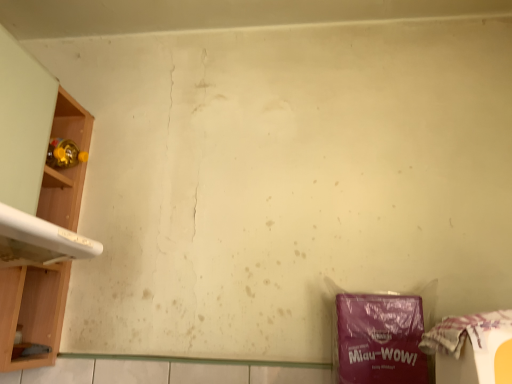
Question: In terms of size, does wooden shelf at left appear bigger or smaller than plastic bag at lower right?

Choices:
 (A) small
 (B) big

Answer: (B)

Question: Would you say wooden shelf at left is to the left or to the right of plastic bag at lower right in the picture?

Choices:
 (A) left
 (B) right

Answer: (A)

Question: Based on their relative distances, which object is farther from the plastic bag at lower right?

Choices:
 (A) wooden shelf at left
 (B) purple matte plastic bag at lower right
 (C) white glossy washing machine at left

Answer: (A)

Question: Which of these objects is positioned farthest from the wooden shelf at left?

Choices:
 (A) white glossy washing machine at left
 (B) plastic bag at lower right
 (C) purple matte plastic bag at lower right

Answer: (B)